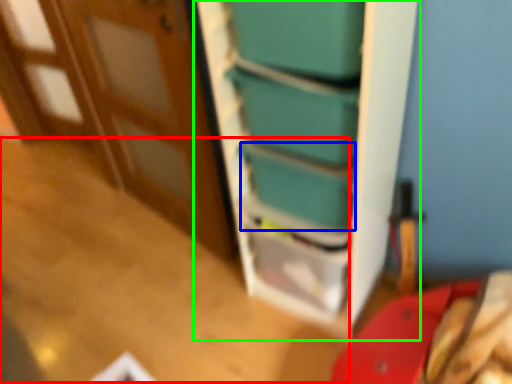
Question: Based on their relative distances, which object is nearer to table (highlighted by a red box)? Choose from box (highlighted by a blue box) and bookshelf (highlighted by a green box).

Choices:
 (A) box
 (B) bookshelf

Answer: (B)